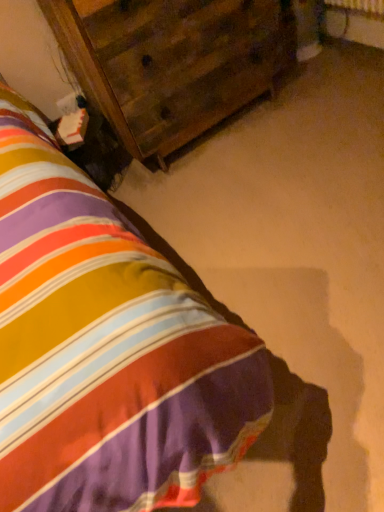
You are a GUI agent. You are given a task and a screenshot of the screen. Output one action in this format:
    pyautogui.click(x=<x>, y=<y>)
    Task: Click on the vacant area located to the right-hand side of wooden dresser at upper left
    This screenshot has width=384, height=512.
    Given the screenshot: What is the action you would take?
    pyautogui.click(x=317, y=93)